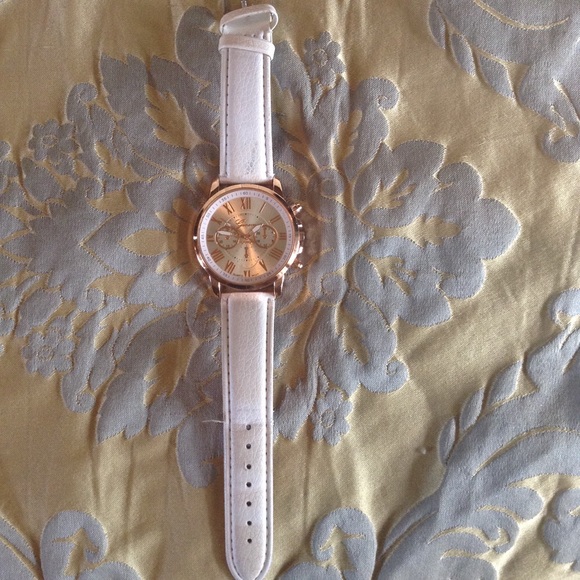
Find the location of a particular element. Image resolution: width=580 pixels, height=580 pixels. clock is located at coordinates (x=245, y=208).